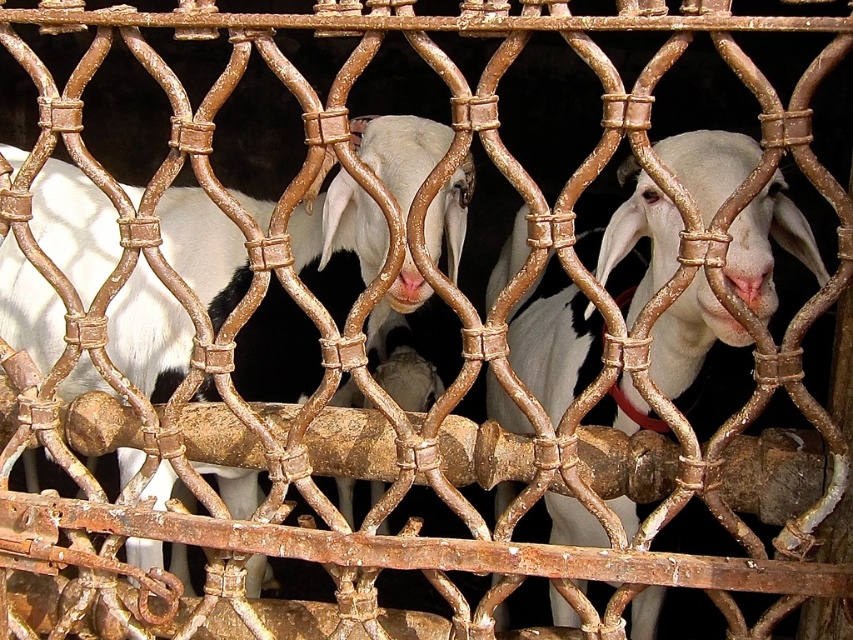
Between white woolen goat at center and white matte goat at center, which one has less height?

With less height is white matte goat at center.

Is white woolen goat at center smaller than white matte goat at center?

No.

Who is more forward, (213,276) or (686,164)?

Positioned in front is point (686,164).

Where is `white woolen goat at center`? The image size is (853, 640). white woolen goat at center is located at coordinates (74, 227).